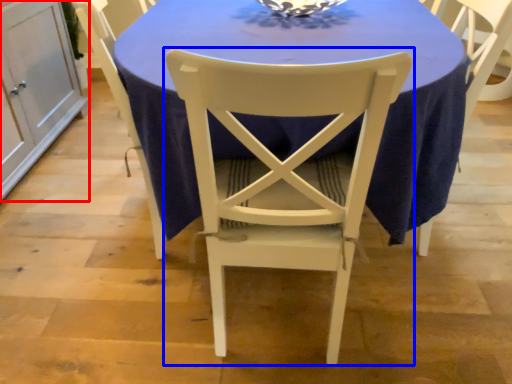
Question: Which of the following is the closest to the observer, cabinetry (highlighted by a red box) or chair (highlighted by a blue box)?

Choices:
 (A) cabinetry
 (B) chair

Answer: (B)